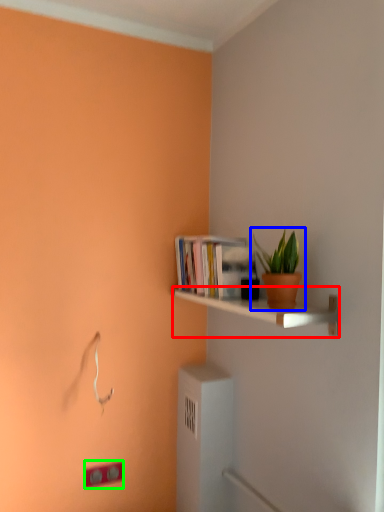
Question: Which is farther away from shelf (highlighted by a red box)? houseplant (highlighted by a blue box) or light switch (highlighted by a green box)?

Choices:
 (A) houseplant
 (B) light switch

Answer: (B)